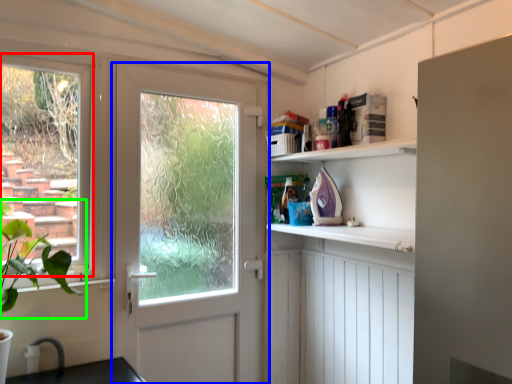
Question: Based on their relative distances, which object is farther from window (highlighted by a red box)? Choose from door (highlighted by a blue box) and plant (highlighted by a green box).

Choices:
 (A) door
 (B) plant

Answer: (A)